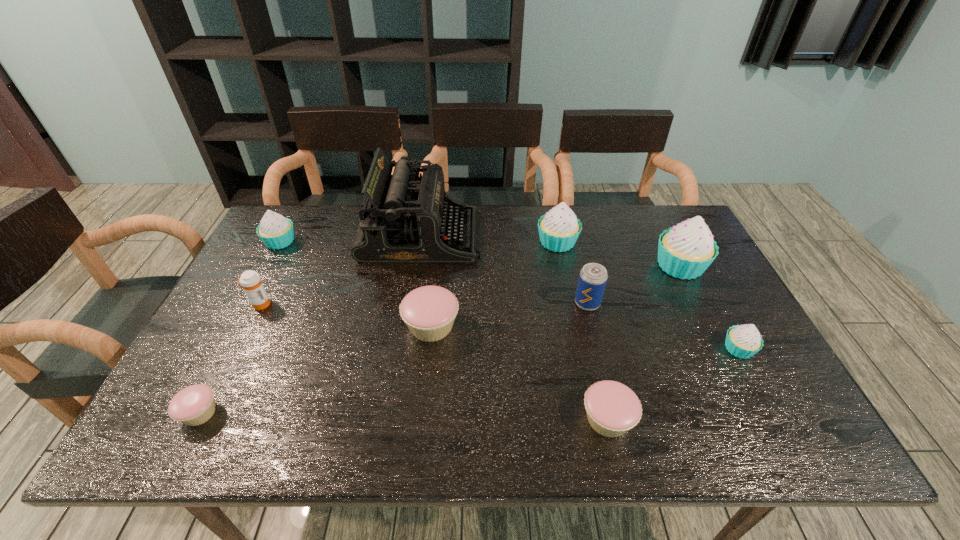
The width and height of the screenshot is (960, 540). Identify the location of the tallest object. (404, 219).

Find the location of a particular element. The height and width of the screenshot is (540, 960). the biggest white cupcake is located at coordinates (685, 251).

What are the coordinates of `the ninth shortest object` in the screenshot? It's located at (685, 251).

This screenshot has height=540, width=960. Identify the location of the second biggest white cupcake. (559, 229).

You are a GUI agent. You are given a task and a screenshot of the screen. Output one action in this format:
    pyautogui.click(x=<x>, y=<y>)
    Task: Click on the third tallest object
    This screenshot has height=540, width=960.
    Given the screenshot: What is the action you would take?
    point(559,229)

Image resolution: width=960 pixels, height=540 pixels. Identify the location of beer can. (593, 277).

Locate an element on the screen. the fifth shortest cupcake is located at coordinates (276, 232).

The image size is (960, 540). In order to click on the third biggest white cupcake in this screenshot , I will do `click(276, 232)`.

You are a GUI agent. You are given a task and a screenshot of the screen. Output one action in this format:
    pyautogui.click(x=<x>, y=<y>)
    Task: Click on the medicine
    The image size is (960, 540).
    Given the screenshot: What is the action you would take?
    pyautogui.click(x=251, y=282)

The width and height of the screenshot is (960, 540). In order to click on the biggest pink cupcake in this screenshot , I will do `click(429, 312)`.